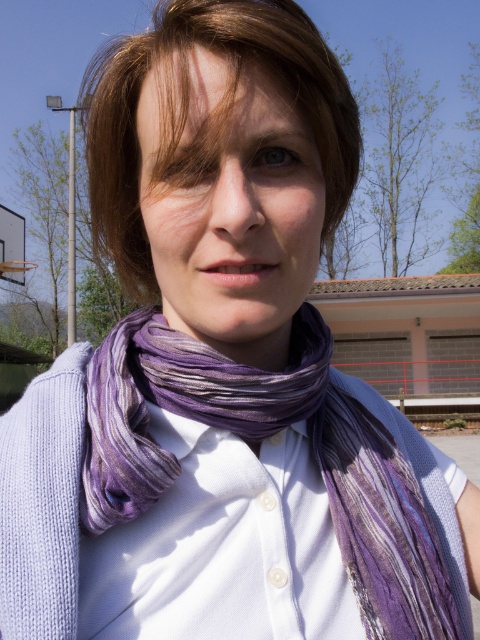
Who is positioned more to the right, brownsmoothhair at center or purple striped scarf at center?

purple striped scarf at center

Which is behind, point (128, 106) or point (236, 321)?

Point (128, 106)

Is point (134, 276) positioned in front of point (228, 308)?

No, it is behind (228, 308).

What are the coordinates of `brownsmoothhair at center` in the screenshot? It's located at (205, 113).

Based on the photo, is purple silk scarf at center bigger than purple striped scarf at center?

Yes.

Is purple silk scarf at center positioned before purple striped scarf at center?

No, purple silk scarf at center is further to the viewer.

Between point (301, 378) and point (241, 314), which one is positioned in front?

Point (241, 314) is more forward.

Identify the location of purple silk scarf at center. (269, 464).

Is point (181, 358) behind point (308, 116)?

Yes, it is.

Measure the distance from purple silk scarf at center to brownsmoothhair at center.

A distance of 8.69 inches exists between purple silk scarf at center and brownsmoothhair at center.

Is point (304, 442) farther from camera compared to point (133, 141)?

Yes, point (304, 442) is behind point (133, 141).

This screenshot has height=640, width=480. In order to click on purple silk scarf at center in this screenshot , I will do `click(269, 464)`.